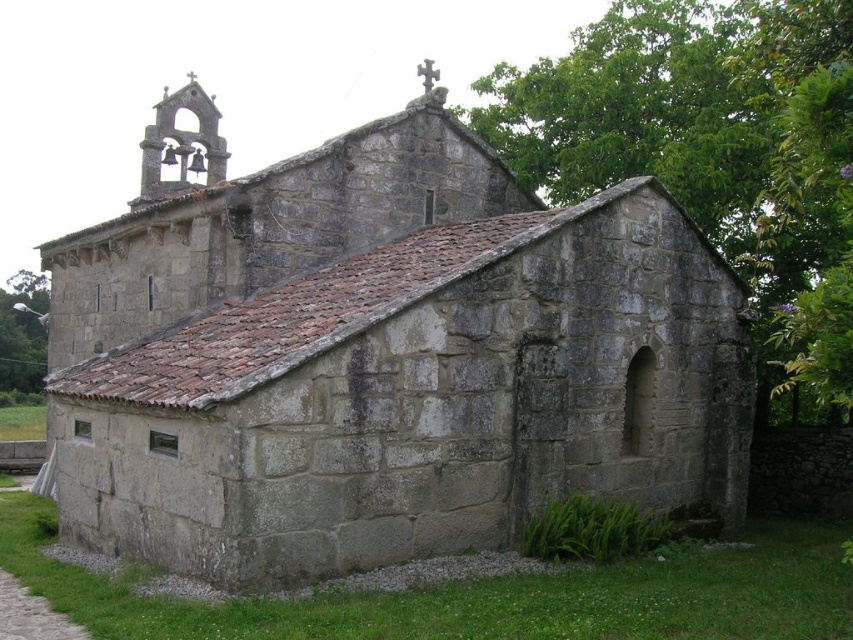
Question: Which point appears closest to the camera in this image?

Choices:
 (A) (35, 637)
 (B) (381, 122)

Answer: (A)

Question: Which of these objects is positioned closest to the green grass at lower left?

Choices:
 (A) gray cobblestone path at lower left
 (B) gray stone church at center

Answer: (A)

Question: Does gray cobblestone path at lower left appear on the right side of green grass at lower left?

Choices:
 (A) no
 (B) yes

Answer: (A)

Question: Is gray stone church at center smaller than green grass at lower left?

Choices:
 (A) yes
 (B) no

Answer: (B)

Question: Which object is positioned farthest from the gray stone church at center?

Choices:
 (A) green grass at lower left
 (B) gray cobblestone path at lower left

Answer: (B)

Question: Does gray stone church at center have a larger size compared to green grass at lower left?

Choices:
 (A) no
 (B) yes

Answer: (B)